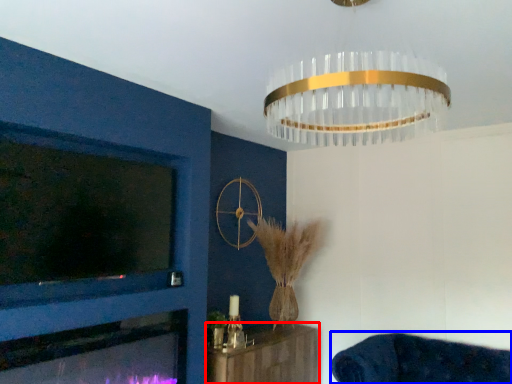
Question: Which object is closer to the camera taking this photo, furniture (highlighted by a red box) or furniture (highlighted by a blue box)?

Choices:
 (A) furniture
 (B) furniture

Answer: (B)